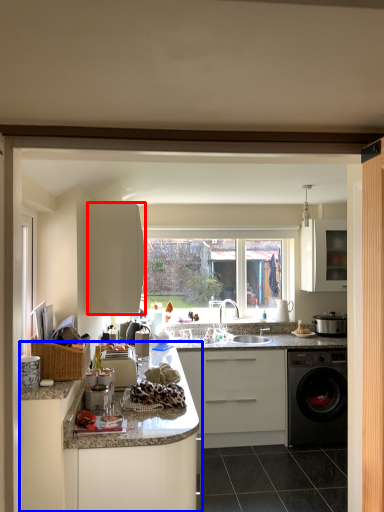
Question: Which point is further to the camera, cabinetry (highlighted by a red box) or cabinetry (highlighted by a blue box)?

Choices:
 (A) cabinetry
 (B) cabinetry

Answer: (A)